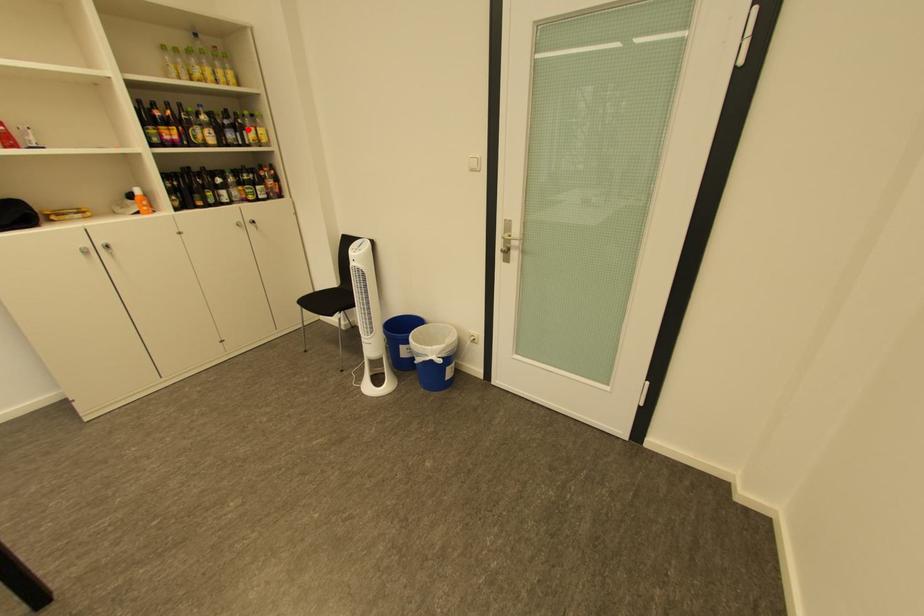
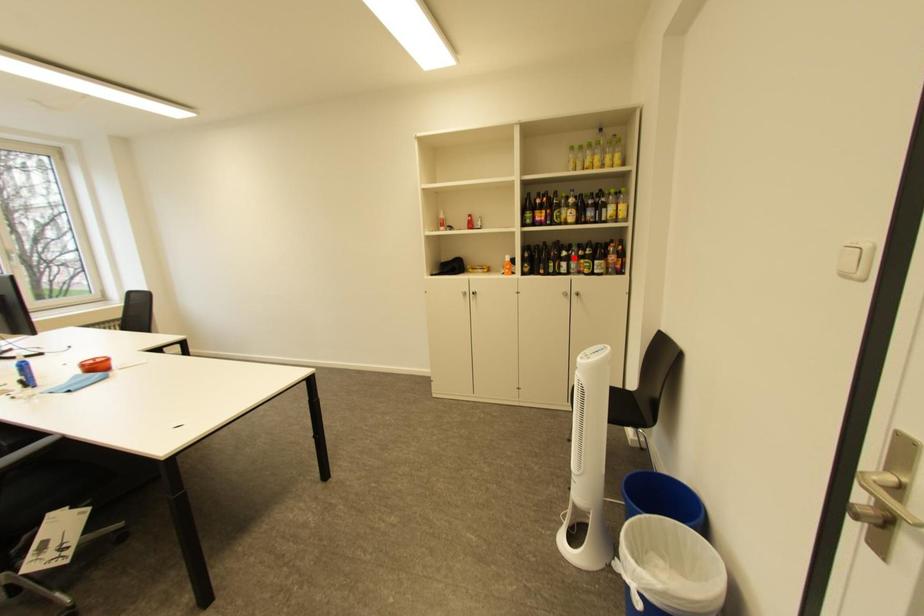
I am providing you with two images of the same scene from different viewpoints. A red point is marked on the first image and another point is marked on the second image. Is the marked point in image1 the same physical position as the marked point in image2?

No